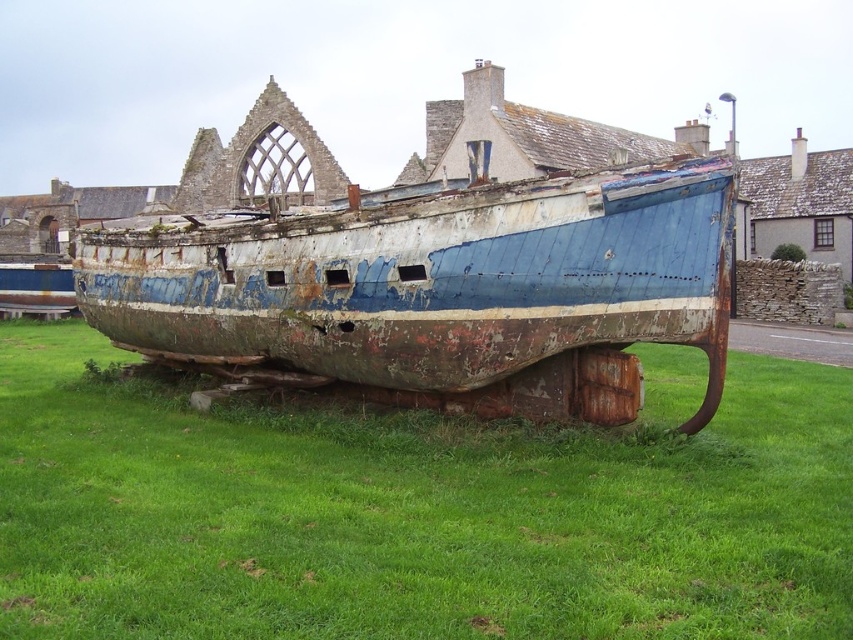
You are a gardener trying to mow the green grass at center. However, the rusty metal boat at center is blocking your path. Can you mow the grass without moving the boat?

The green grass at center is below the rusty metal boat at center, so the boat is covering part of the grass. You will need to move the boat to mow the grass properly.